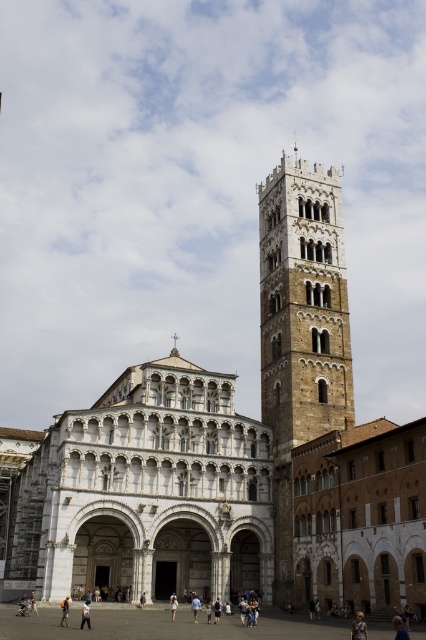
You are standing in the historic architectural scene described. You notice a point marked at coordinates (x=141, y=492). What significant structure does this point indicate?

The point at (x=141, y=492) marks the white stone cathedral at center.